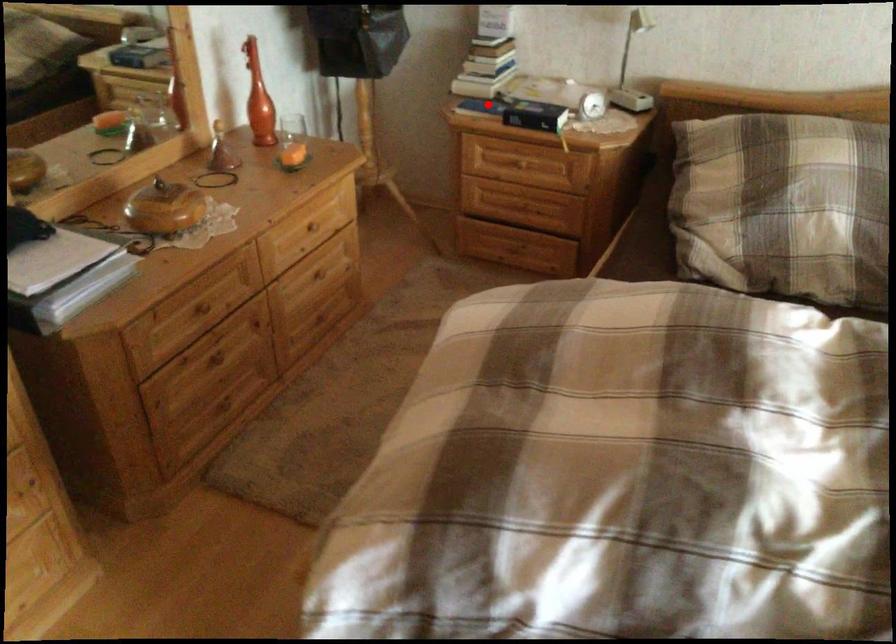
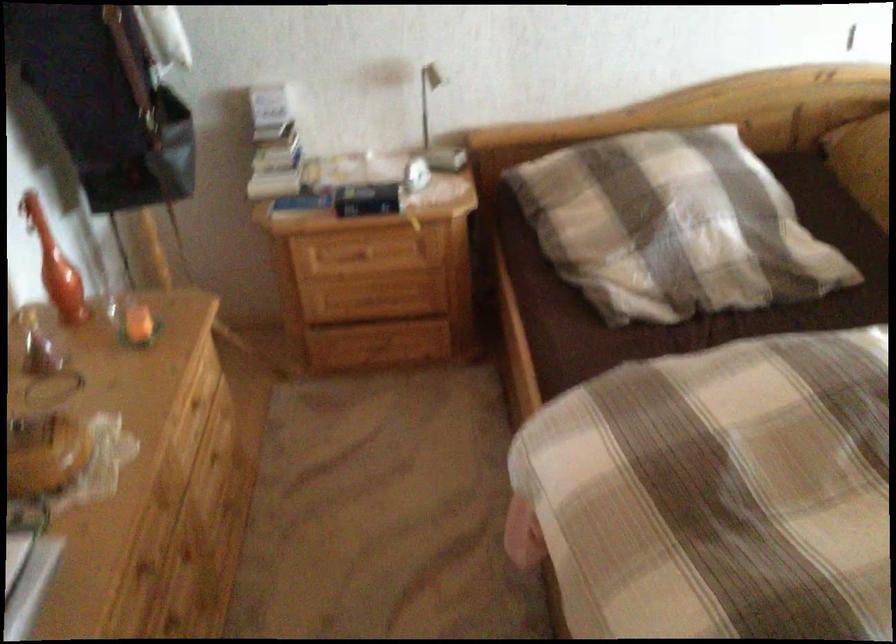
Question: I am providing you with two images of the same scene from different viewpoints. Given a red point in image1, look at the same physical point in image2. Is it:

Choices:
 (A) Closer to the viewpoint
 (B) Farther from the viewpoint

Answer: (A)